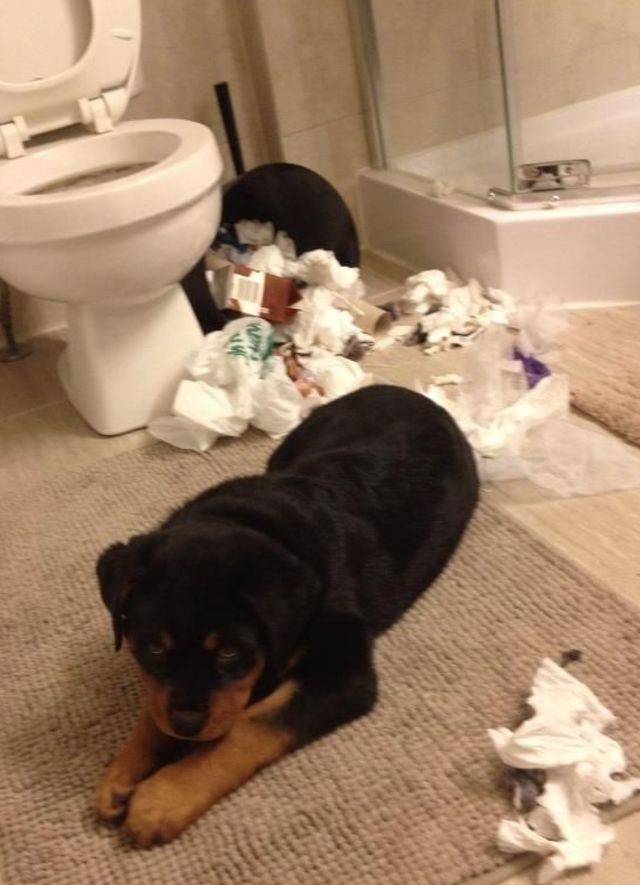
Find the location of a particular element. This screenshot has height=885, width=640. shower glass is located at coordinates (569, 45), (456, 87).